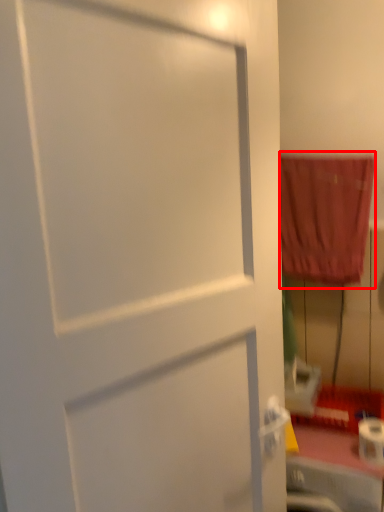
Question: From the image's perspective, what is the correct spatial relationship of curtain (annotated by the red box) in relation to toilet paper?

Choices:
 (A) below
 (B) above

Answer: (B)